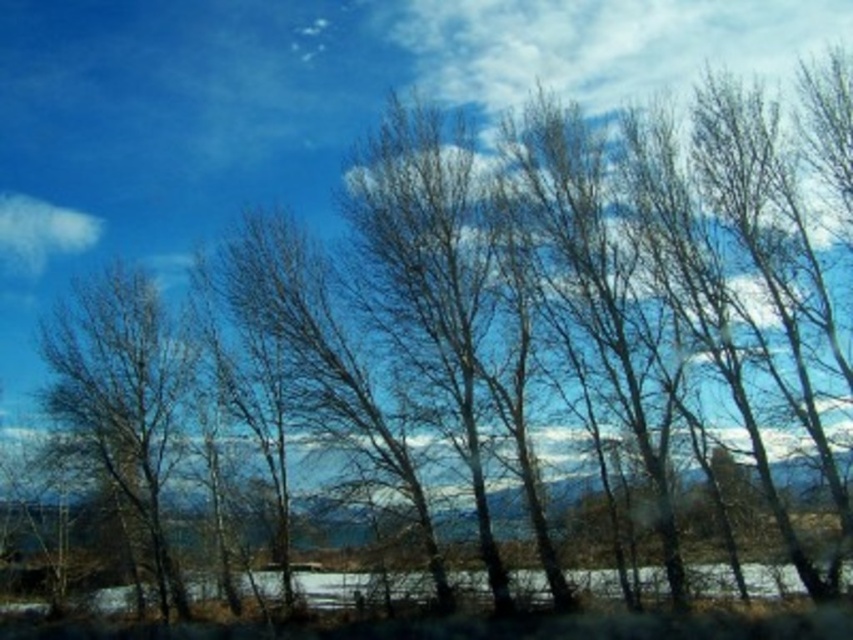
You are standing at the center of the scene looking towards the distant mountain range. Where are the bare branches at left located relative to your position?

The bare branches at left are located at coordinates point (x=120, y=401), which places them to the left side of the scene relative to your central position.

You are an artist painting the landscape scene. You want to ensure the bare branches at left and the white fluffy cloud at upper left are positioned correctly. According to the scene, which object is located to the right of the other?

The bare branches at left is to the right of the white fluffy cloud at upper left.

You are standing in the serene landscape with the row of leafless trees in front of you. There is a point marked at coordinates point [114,452]. Can you determine if this point is within a safe distance for a drone to land? The drone has a maximum landing distance of 100 meters.

The point [114,452] is 92.79 meters away from the viewer, which is within the drone landing distance of 100 meters. Therefore, the drone can safely land at that point.